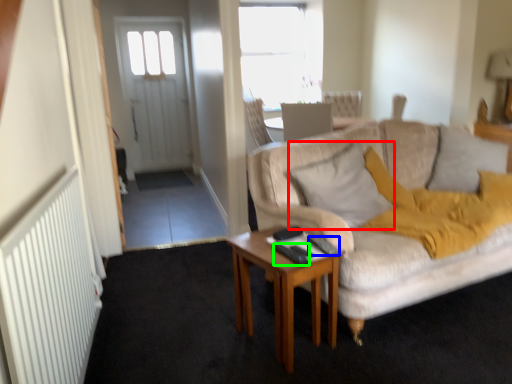
Question: Based on their relative distances, which object is farther from pillow (highlighted by a red box)? Choose from remote control (highlighted by a blue box) and remote control (highlighted by a green box).

Choices:
 (A) remote control
 (B) remote control

Answer: (B)